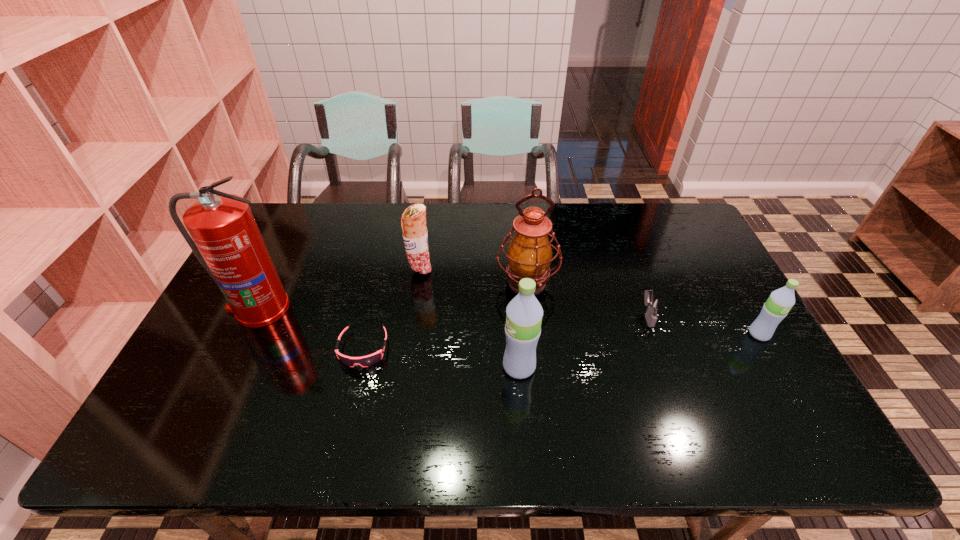
This screenshot has width=960, height=540. Identify the location of vacant area in the image that satisfies the following two spatial constraints: 1. on the back side of the sixth tallest object; 2. on the right side of the taller water bottle. (516, 315).

You are a GUI agent. You are given a task and a screenshot of the screen. Output one action in this format:
    pyautogui.click(x=<x>, y=<y>)
    Task: Click on the blank space that satisfies the following two spatial constraints: 1. on the back side of the second shortest object; 2. on the right side of the left water bottle
    Image resolution: width=960 pixels, height=540 pixels.
    Given the screenshot: What is the action you would take?
    pyautogui.click(x=516, y=315)

The image size is (960, 540). I want to click on free space that satisfies the following two spatial constraints: 1. on the instruction side of the leftmost object; 2. on the left side of the right water bottle, so click(247, 334).